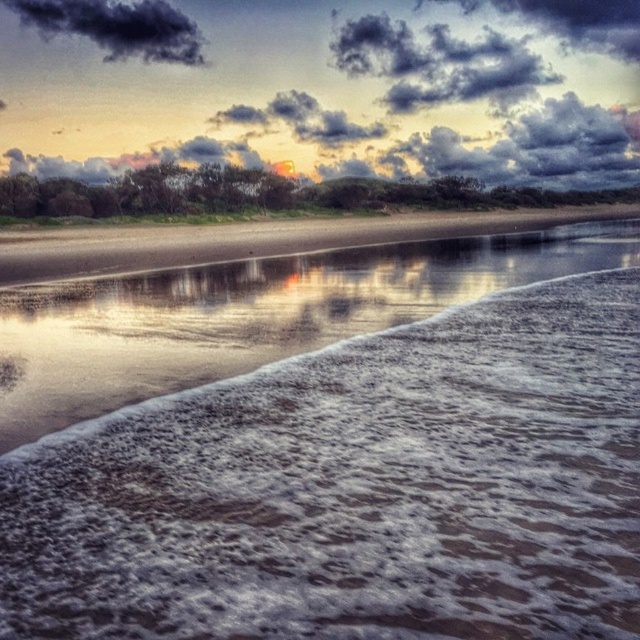
Question: Which of these objects is positioned farthest from the dark gray fluffy cloud at upper center?

Choices:
 (A) white frothy water at lower left
 (B) dark gray fluffy cloud at upper left

Answer: (A)

Question: Which object is positioned farthest from the white frothy water at lower left?

Choices:
 (A) dark gray fluffy cloud at upper left
 (B) dark gray fluffy cloud at upper center

Answer: (A)

Question: In this image, where is dark textured cloud at upper center located relative to dark gray fluffy cloud at upper center?

Choices:
 (A) left
 (B) right

Answer: (B)

Question: Which of the following is the farthest from the observer?

Choices:
 (A) dark gray fluffy cloud at upper left
 (B) dark textured cloud at upper center
 (C) dark gray fluffy cloud at upper center

Answer: (A)

Question: In this image, where is white frothy water at lower left located relative to dark gray fluffy cloud at upper left?

Choices:
 (A) right
 (B) left

Answer: (A)

Question: Does white frothy water at lower left appear under dark textured cloud at upper center?

Choices:
 (A) yes
 (B) no

Answer: (A)